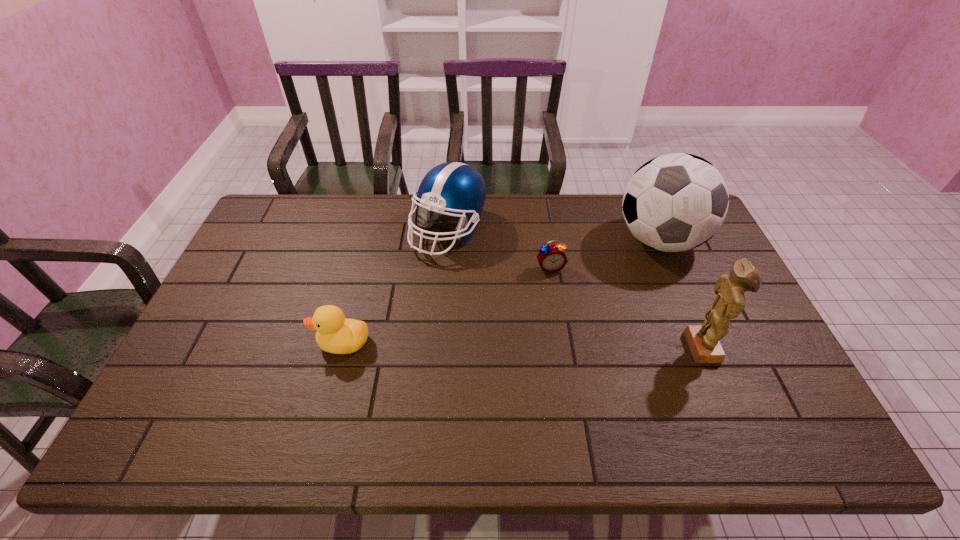
You are a GUI agent. You are given a task and a screenshot of the screen. Output one action in this format:
    pyautogui.click(x=<x>, y=<y>)
    Task: Click on the football helmet situated at the far edge
    
    Given the screenshot: What is the action you would take?
    pyautogui.click(x=453, y=188)

Locate an element on the screen. Image resolution: width=960 pixels, height=540 pixels. figurine located in the right edge section of the desktop is located at coordinates 703,340.

You are a GUI agent. You are given a task and a screenshot of the screen. Output one action in this format:
    pyautogui.click(x=<x>, y=<y>)
    Task: Click on the soccer ball present at the right edge
    This screenshot has height=540, width=960.
    Given the screenshot: What is the action you would take?
    pyautogui.click(x=675, y=202)

I want to click on object that is positioned at the far right corner, so click(675, 202).

In the image, there is a desktop. Where is `vacant space at the far edge`? The height and width of the screenshot is (540, 960). vacant space at the far edge is located at coordinates (x=331, y=204).

This screenshot has width=960, height=540. I want to click on vacant space at the near edge of the desktop, so click(x=316, y=400).

You are a GUI agent. You are given a task and a screenshot of the screen. Output one action in this format:
    pyautogui.click(x=<x>, y=<y>)
    Task: Click on the free space at the left edge of the desktop
    
    Given the screenshot: What is the action you would take?
    pyautogui.click(x=255, y=316)

The height and width of the screenshot is (540, 960). In the image, there is a desktop. In order to click on vacant space at the right edge in this screenshot , I will do `click(714, 260)`.

Image resolution: width=960 pixels, height=540 pixels. In the image, there is a desktop. Identify the location of free space at the far left corner. (264, 220).

In the image, there is a desktop. What are the coordinates of `vacant space at the near left corner` in the screenshot? It's located at (234, 387).